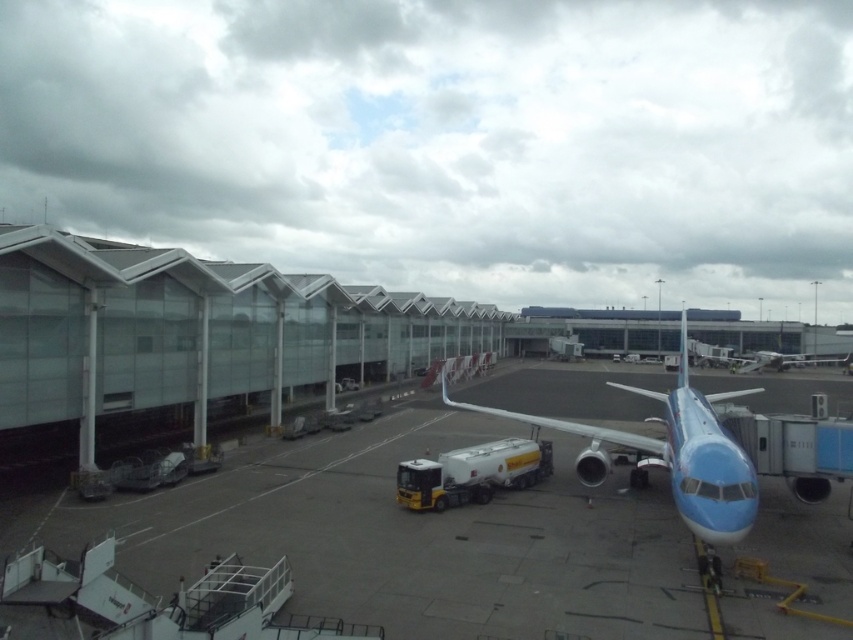
You are a maintenance worker standing on the smooth concrete tarmac at center. You need to inspect the blue glossy airplane at center. Which direction should you move to get a better view of its top section?

The smooth concrete tarmac at center is lower than the blue glossy airplane at center, so you should move to a higher position, like the jet bridge or a service vehicle, to get a better view of the airplane.

You are standing on the smooth concrete tarmac at center and want to walk to the blue glossy airplane at center. Which direction should you move in?

The smooth concrete tarmac at center is to the left of the blue glossy airplane at center, so you should move to the right to reach it.

Based on the airport scene described, what is the 2D coordinate of the smooth concrete tarmac at center?

The smooth concrete tarmac at center is located at the 2D coordinate point of [468,541].